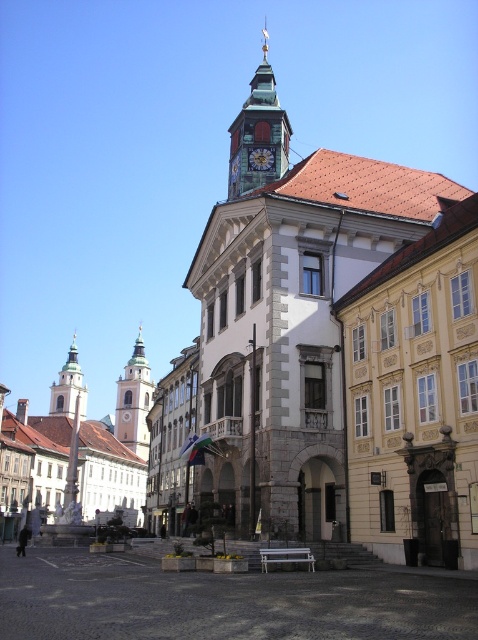
Question: Among these objects, which one is nearest to the camera?

Choices:
 (A) green stone tower at left
 (B) green copper clock tower at upper center
 (C) gold metallic clock at center

Answer: (B)

Question: Does smooth white tower at center have a lesser width compared to green stone tower at left?

Choices:
 (A) no
 (B) yes

Answer: (A)

Question: Considering the real-world distances, which object is farthest from the green stone tower at left?

Choices:
 (A) green copper clock tower at upper center
 (B) gold metallic clock at center
 (C) smooth white tower at center

Answer: (B)

Question: Can you confirm if green copper clock tower at upper center is positioned below smooth white tower at center?

Choices:
 (A) yes
 (B) no

Answer: (B)

Question: Can you confirm if smooth white tower at center is bigger than gold metallic clock at center?

Choices:
 (A) yes
 (B) no

Answer: (A)

Question: Which is farther from the green copper clock tower at upper center?

Choices:
 (A) smooth white tower at center
 (B) gold metallic clock at center
 (C) green stone tower at left

Answer: (C)